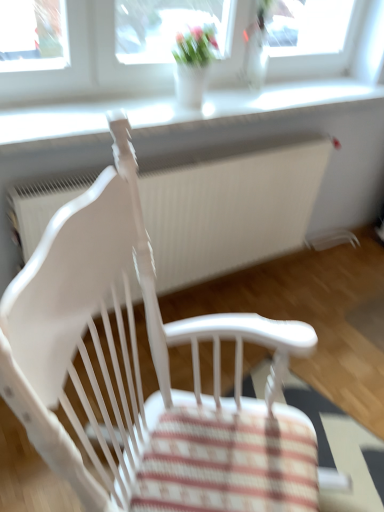
Question: From a real-world perspective, is white wood chair at center positioned under white plastic window sill at upper center based on gravity?

Choices:
 (A) yes
 (B) no

Answer: (A)

Question: Is the depth of white wood chair at center greater than that of white plastic window sill at upper center?

Choices:
 (A) yes
 (B) no

Answer: (B)

Question: Can you confirm if white wood chair at center is smaller than white plastic window sill at upper center?

Choices:
 (A) no
 (B) yes

Answer: (A)

Question: Considering the relative sizes of white wood chair at center and white plastic window sill at upper center in the image provided, is white wood chair at center thinner than white plastic window sill at upper center?

Choices:
 (A) no
 (B) yes

Answer: (A)

Question: Does white wood chair at center lie in front of white plastic window sill at upper center?

Choices:
 (A) no
 (B) yes

Answer: (B)

Question: Does white wood chair at center have a larger size compared to white plastic window sill at upper center?

Choices:
 (A) yes
 (B) no

Answer: (A)

Question: Is white wood chair at center positioned before white textured radiator at center?

Choices:
 (A) no
 (B) yes

Answer: (B)

Question: From a real-world perspective, is white wood chair at center physically below white textured radiator at center?

Choices:
 (A) yes
 (B) no

Answer: (B)

Question: Does white wood chair at center have a lesser height compared to white textured radiator at center?

Choices:
 (A) no
 (B) yes

Answer: (A)

Question: Is white textured radiator at center a part of white wood chair at center?

Choices:
 (A) no
 (B) yes

Answer: (A)

Question: Can you confirm if white wood chair at center is positioned to the left of white textured radiator at center?

Choices:
 (A) no
 (B) yes

Answer: (A)

Question: From the image's perspective, is white wood chair at center beneath white textured radiator at center?

Choices:
 (A) yes
 (B) no

Answer: (A)

Question: Is white plastic window sill at upper center next to white wood chair at center and touching it?

Choices:
 (A) yes
 (B) no

Answer: (B)